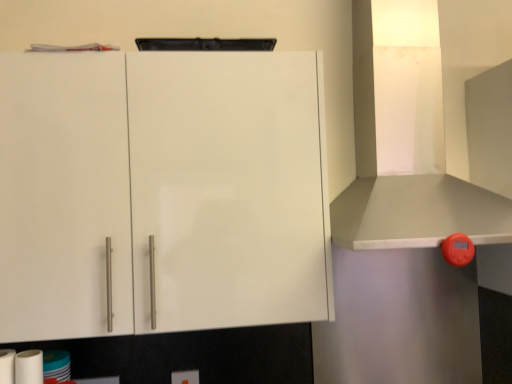
Question: In terms of height, does white glossy toilet paper at lower left look taller or shorter compared to white matte paper towel at lower left, the 2th paper towel viewed from the left?

Choices:
 (A) short
 (B) tall

Answer: (A)

Question: From a real-world perspective, is white glossy toilet paper at lower left positioned above or below white matte paper towel at lower left, the 2th paper towel viewed from the left?

Choices:
 (A) below
 (B) above

Answer: (A)

Question: Which object is the closest to the white glossy cabinet at upper left?

Choices:
 (A) white glossy toilet paper at lower left
 (B) white matte paper towel at lower left, the 2th paper towel in the right-to-left sequence
 (C) white matte paper towel at lower left, arranged as the first paper towel when viewed from the right
 (D) white glossy exhaust hood at upper right

Answer: (A)

Question: Which object is positioned closest to the white matte paper towel at lower left, arranged as the first paper towel when viewed from the right?

Choices:
 (A) white matte paper towel at lower left, the 1th paper towel from the left
 (B) white glossy toilet paper at lower left
 (C) white glossy exhaust hood at upper right
 (D) white glossy cabinet at upper left

Answer: (A)